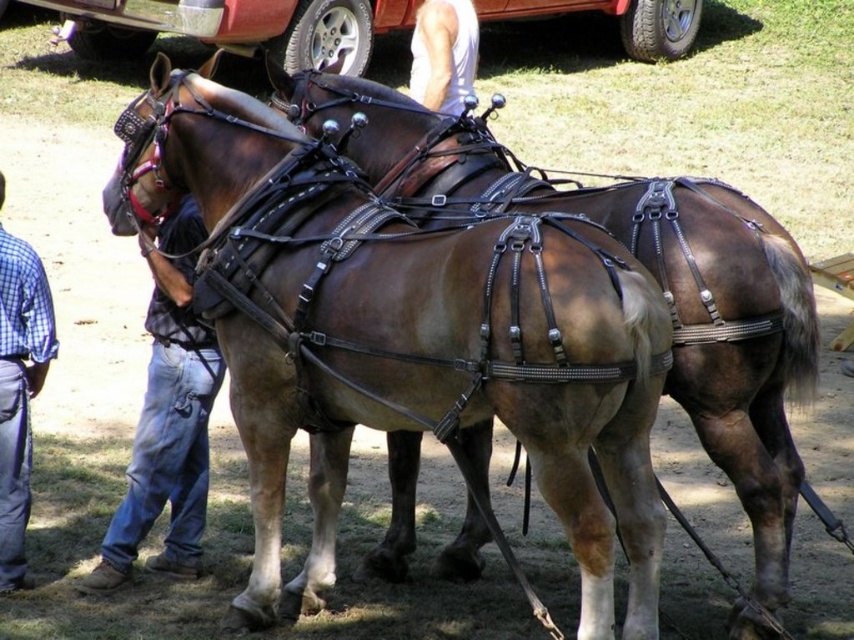
Can you confirm if brown leather harness at center is bigger than blue plaid shirt at left?

Correct, brown leather harness at center is larger in size than blue plaid shirt at left.

Does brown leather harness at center have a lesser width compared to blue plaid shirt at left?

Incorrect, brown leather harness at center's width is not less than blue plaid shirt at left's.

Describe the element at coordinates (407, 339) in the screenshot. I see `brown leather harness at center` at that location.

Image resolution: width=854 pixels, height=640 pixels. In order to click on brown leather harness at center in this screenshot , I will do `click(407, 339)`.

Measure the distance between brown leather harness at center and blue jeans at left.

brown leather harness at center and blue jeans at left are 1.08 meters apart from each other.

Between point (601, 448) and point (159, 276), which one is positioned in front?

Point (601, 448)

This screenshot has height=640, width=854. I want to click on brown leather harness at center, so click(407, 339).

Is brown leather harness at center in front of white tank top at upper center?

Yes, it is.

This screenshot has height=640, width=854. What are the coordinates of `brown leather harness at center` in the screenshot? It's located at (407, 339).

You are a GUI agent. You are given a task and a screenshot of the screen. Output one action in this format:
    pyautogui.click(x=<x>, y=<y>)
    Task: Click on the brown leather harness at center
    
    Given the screenshot: What is the action you would take?
    pyautogui.click(x=407, y=339)